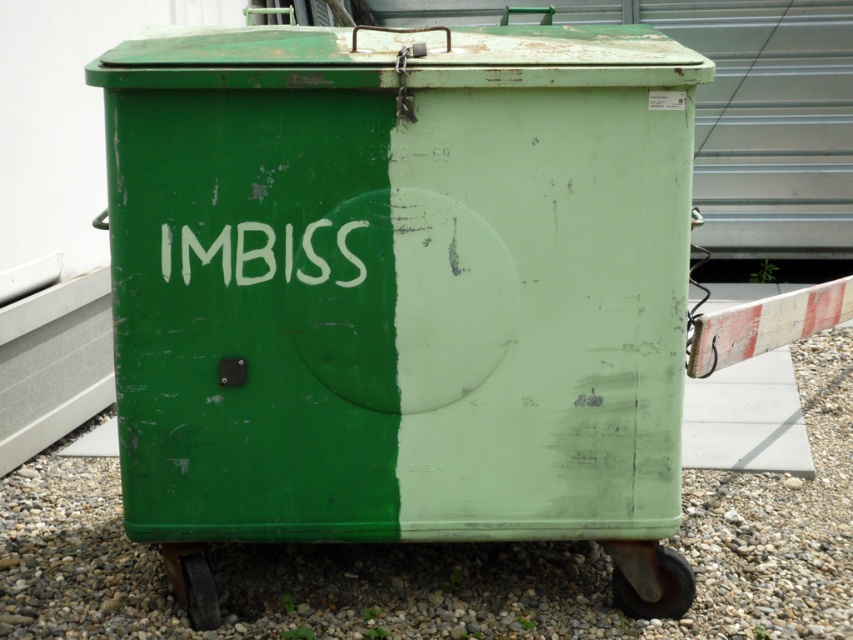
Who is positioned more to the right, green matte container at center or green gravel at lower center?

From the viewer's perspective, green matte container at center appears more on the right side.

Does point (448, 202) come farther from viewer compared to point (260, 588)?

No, it is in front of (260, 588).

At what (x,y) coordinates should I click in order to perform the action: click on green matte container at center. Please return your answer as a coordinate pair (x, y). Looking at the image, I should click on (403, 285).

Does point (329, 586) come closer to viewer compared to point (666, 554)?

No.

Does green gravel at lower center have a greater width compared to rubber/rough wheel at lower right?

Indeed, green gravel at lower center has a greater width compared to rubber/rough wheel at lower right.

The width and height of the screenshot is (853, 640). I want to click on green gravel at lower center, so click(454, 557).

Between rubber/rough wheel at lower right and metallic gray wheel at lower left, which one appears on the left side from the viewer's perspective?

Positioned to the left is metallic gray wheel at lower left.

From the picture: Who is higher up, rubber/rough wheel at lower right or metallic gray wheel at lower left?

metallic gray wheel at lower left is higher up.

This screenshot has height=640, width=853. What do you see at coordinates (660, 586) in the screenshot? I see `rubber/rough wheel at lower right` at bounding box center [660, 586].

You are a GUI agent. You are given a task and a screenshot of the screen. Output one action in this format:
    pyautogui.click(x=<x>, y=<y>)
    Task: Click on the rubber/rough wheel at lower right
    The width and height of the screenshot is (853, 640).
    Given the screenshot: What is the action you would take?
    pyautogui.click(x=660, y=586)